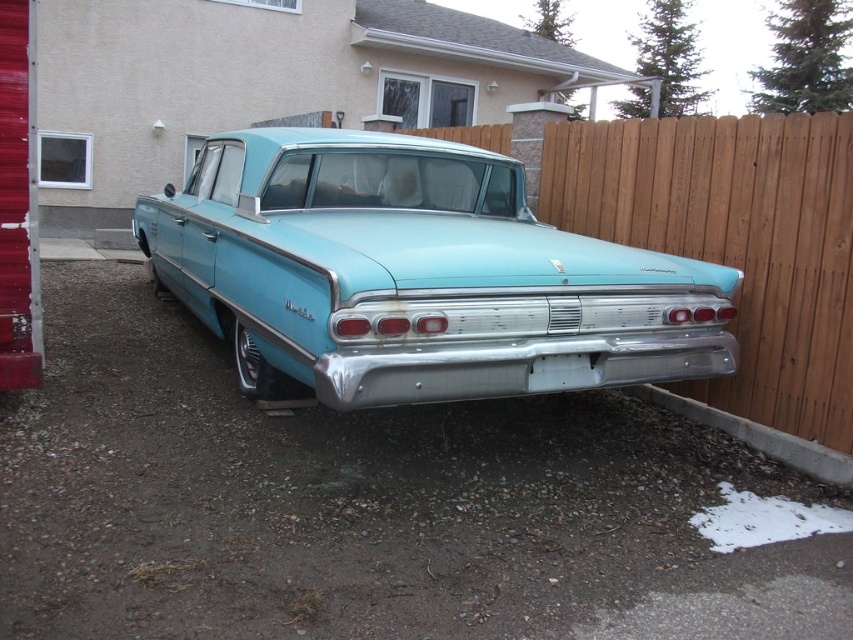
Question: Which point is closer to the camera taking this photo?

Choices:
 (A) (178, 266)
 (B) (605, 196)

Answer: (B)

Question: Which point is closer to the camera taking this photo?

Choices:
 (A) (67, 440)
 (B) (849, 202)
 (C) (675, 284)

Answer: (A)

Question: Among these points, which one is farthest from the camera?

Choices:
 (A) (769, 369)
 (B) (161, 406)

Answer: (A)

Question: Does smooth asphalt driveway at center appear under wooden fence at right?

Choices:
 (A) yes
 (B) no

Answer: (A)

Question: Is smooth asphalt driveway at center to the right of light blue metallic car at center from the viewer's perspective?

Choices:
 (A) no
 (B) yes

Answer: (B)

Question: Is light blue metallic car at center positioned before wooden fence at right?

Choices:
 (A) no
 (B) yes

Answer: (B)